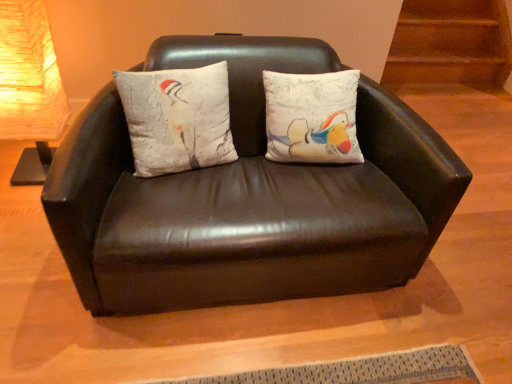
Question: From a real-world perspective, is matte black couch at center physically located above or below textured white pillow with bird design at center?

Choices:
 (A) below
 (B) above

Answer: (A)

Question: Considering the positions of point (81, 243) and point (146, 110), is point (81, 243) closer or farther from the camera than point (146, 110)?

Choices:
 (A) farther
 (B) closer

Answer: (B)

Question: Which is nearer to the matte white lampshade at left?

Choices:
 (A) matte black couch at center
 (B) textured white pillow with bird design at center

Answer: (B)

Question: Estimate the real-world distances between objects in this image. Which object is farther from the textured white pillow with bird design at center?

Choices:
 (A) matte black couch at center
 (B) matte white lampshade at left

Answer: (B)